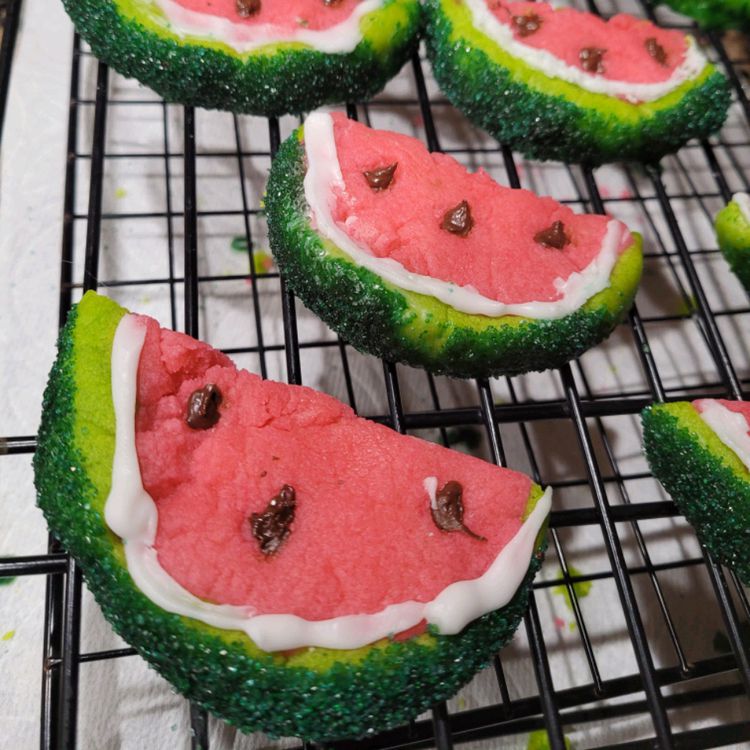
Locate an element on the screen. paper towels is located at coordinates (595, 603), (16, 656), (234, 310).